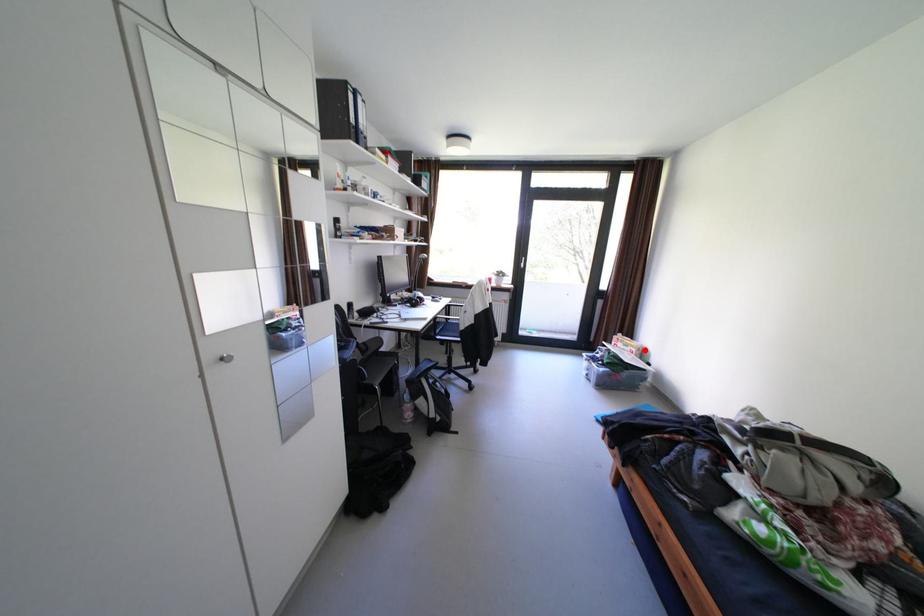
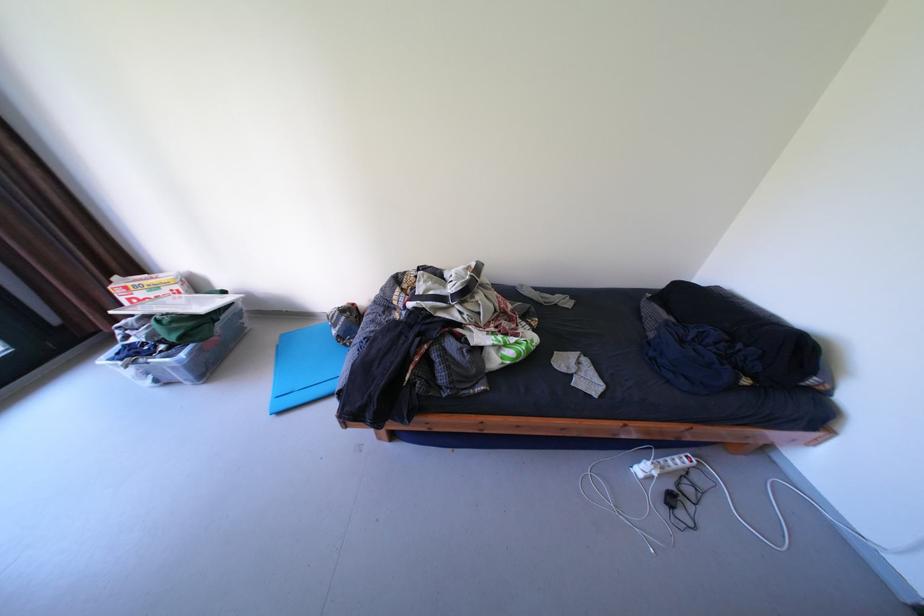
Question: A red point is marked in image1. In image2, is the corresponding 3D point closer to the camera or farther? Reply with the corresponding letter.

Choices:
 (A) The corresponding 3D point is closer.
 (B) The corresponding 3D point is farther.

Answer: (A)